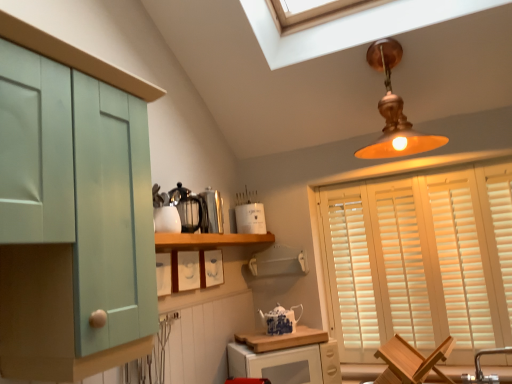
Question: Considering the positions of white wooden blinds at right and metallic silver kettle at center, placed as the 2th appliance when sorted from back to front, in the image, is white wooden blinds at right taller or shorter than metallic silver kettle at center, placed as the 2th appliance when sorted from back to front,?

Choices:
 (A) tall
 (B) short

Answer: (A)

Question: Does point (402, 235) appear closer or farther from the camera than point (209, 221)?

Choices:
 (A) farther
 (B) closer

Answer: (A)

Question: Based on their relative distances, which object is farther from the wooden cutting board at lower center?

Choices:
 (A) polished stainless steel kettle at upper center, acting as the first appliance starting from the front
 (B) wooden shelf at center
 (C) white matte container at upper center, arranged as the first appliance when viewed from the back
 (D) blue and white porcelain teapot at center
 (E) white wooden blinds at right

Answer: (A)

Question: Estimate the real-world distances between objects in this image. Which object is closer to the white wooden blinds at right?

Choices:
 (A) wooden cutting board at lower center
 (B) metallic silver kettle at center, placed as the 2th appliance when sorted from back to front
 (C) brushed metal faucet at lower right
 (D) wooden chair at lower right
 (E) blue and white porcelain teapot at center

Answer: (D)